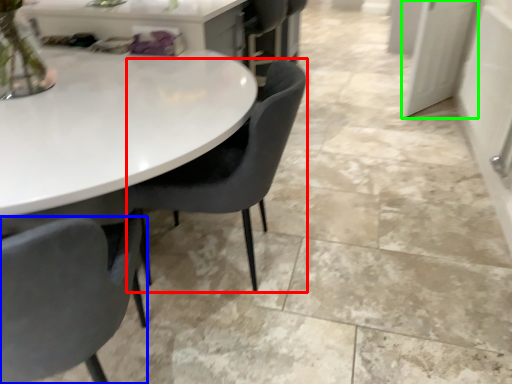
Question: Which object is positioned farthest from chair (highlighted by a red box)? Select from chair (highlighted by a blue box) and glass door (highlighted by a green box).

Choices:
 (A) chair
 (B) glass door

Answer: (B)